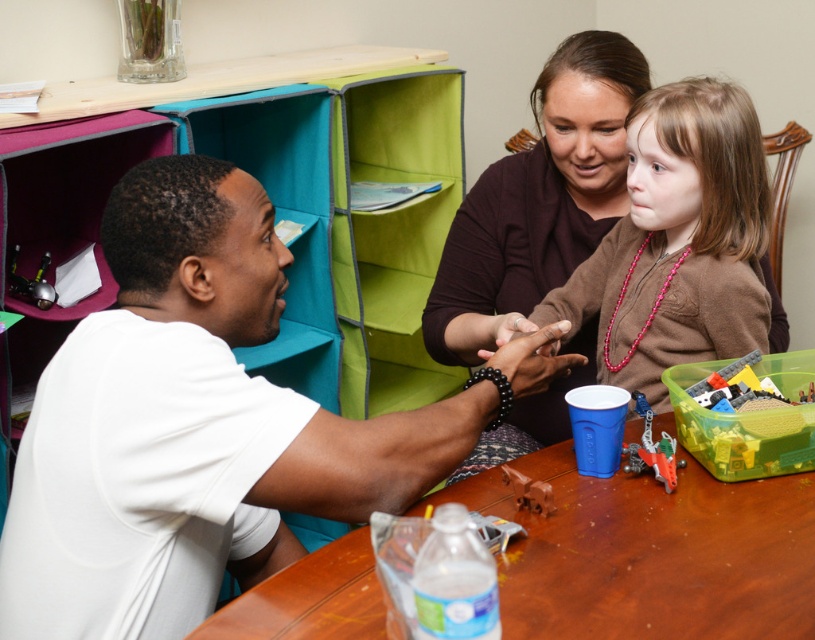
You are organizing a small event and need to place the translucent plastic container at lower right on top of the matte brown sweater at center. Will the container fit on the sweater without hanging over the edges?

The matte brown sweater at center is bigger than the translucent plastic container at lower right, so the container will fit on the sweater without hanging over the edges.